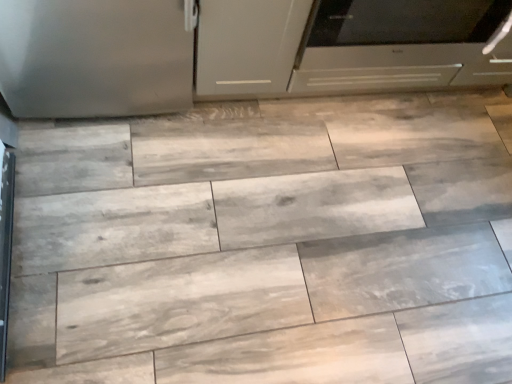
Question: In terms of height, does matte white cabinet at center look taller or shorter compared to satin silver oven at center?

Choices:
 (A) short
 (B) tall

Answer: (A)

Question: Is point (195, 89) positioned closer to the camera than point (354, 86)?

Choices:
 (A) closer
 (B) farther

Answer: (A)

Question: Is matte white cabinet at center spatially inside satin silver oven at center, or outside of it?

Choices:
 (A) outside
 (B) inside

Answer: (A)

Question: In terms of height, does satin silver oven at center look taller or shorter compared to matte white cabinet at center?

Choices:
 (A) tall
 (B) short

Answer: (A)

Question: Is point coord(361,6) closer or farther from the camera than point coord(269,13)?

Choices:
 (A) closer
 (B) farther

Answer: (B)

Question: Is satin silver oven at center inside or outside of matte white cabinet at center?

Choices:
 (A) inside
 (B) outside

Answer: (B)

Question: From a real-world perspective, is satin silver oven at center positioned above or below matte white cabinet at center?

Choices:
 (A) below
 (B) above

Answer: (B)